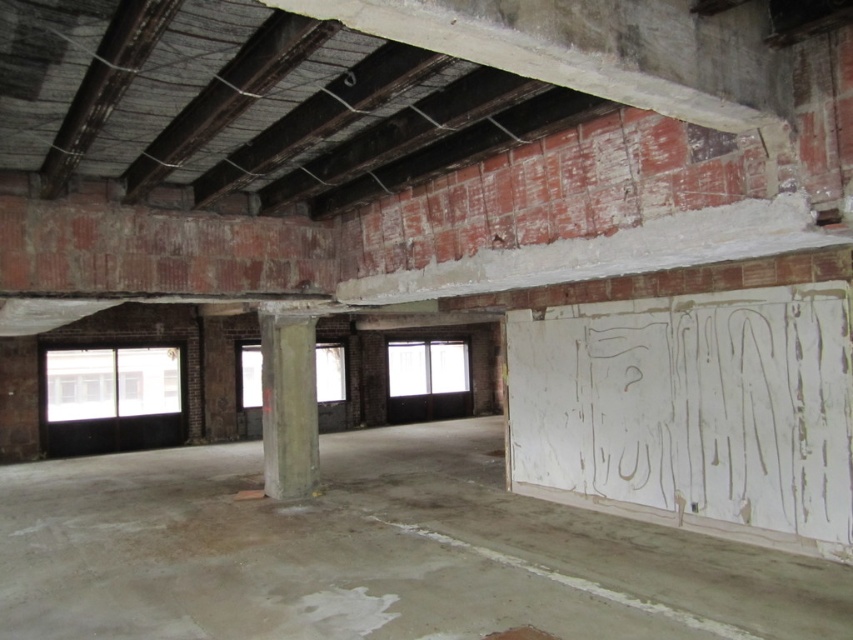
You are a construction worker standing on the concrete floor at center. You need to place a heavy equipment on the floor. Is there enough space around the concrete pillar at center to do so?

The concrete floor at center is positioned under the concrete pillar at center, so placing heavy equipment around the pillar may be challenging due to limited space. Ensure there is adequate clearance before placing the equipment.